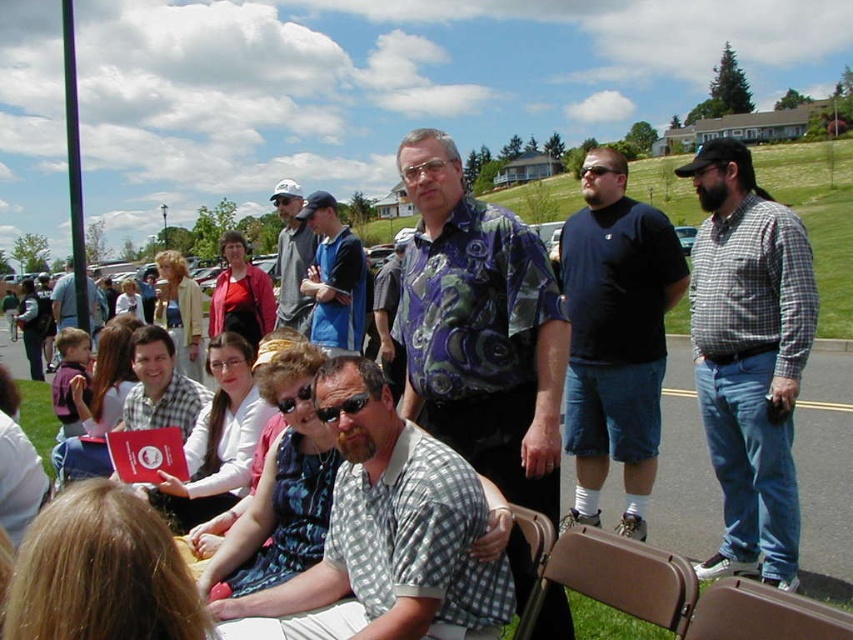
Does dark blue t-shirt at center appear over sunglasses at center?

Yes.

Is dark blue t-shirt at center below sunglasses at center?

No.

The height and width of the screenshot is (640, 853). In order to click on dark blue t-shirt at center in this screenshot , I will do `click(614, 339)`.

Identify the location of dark blue t-shirt at center. This screenshot has height=640, width=853. (614, 339).

Is checkered fabric shirt at center thinner than matte black shirt at center?

Correct, checkered fabric shirt at center's width is less than matte black shirt at center's.

Is checkered fabric shirt at center wider than matte black shirt at center?

In fact, checkered fabric shirt at center might be narrower than matte black shirt at center.

Where is `checkered fabric shirt at center`? checkered fabric shirt at center is located at coordinates [x=386, y=538].

Is point (503, 292) positioned in front of point (750, 627)?

No, it is behind (750, 627).

Can you confirm if blue paisley shirt at center is smaller than brown plastic chair at lower right?

No.

Measure the distance between point (407, 188) and camera.

They are 17.90 feet apart.

At what (x,y) coordinates should I click in order to perform the action: click on blue paisley shirt at center. Please return your answer as a coordinate pair (x, y). Looking at the image, I should click on (480, 330).